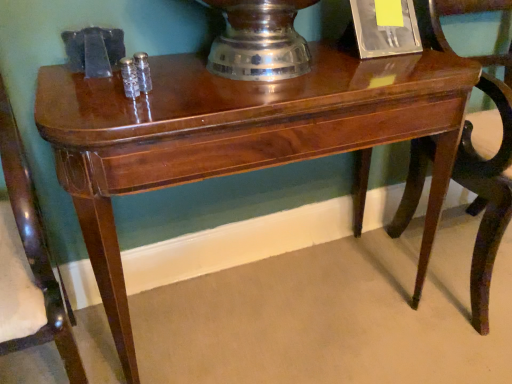
At what (x,y) coordinates should I click in order to perform the action: click on free point below mahogany wood chair at right, acting as the first chair starting from the right (from a real-world perspective). Please return your answer as a coordinate pair (x, y). The width and height of the screenshot is (512, 384). Looking at the image, I should click on (443, 259).